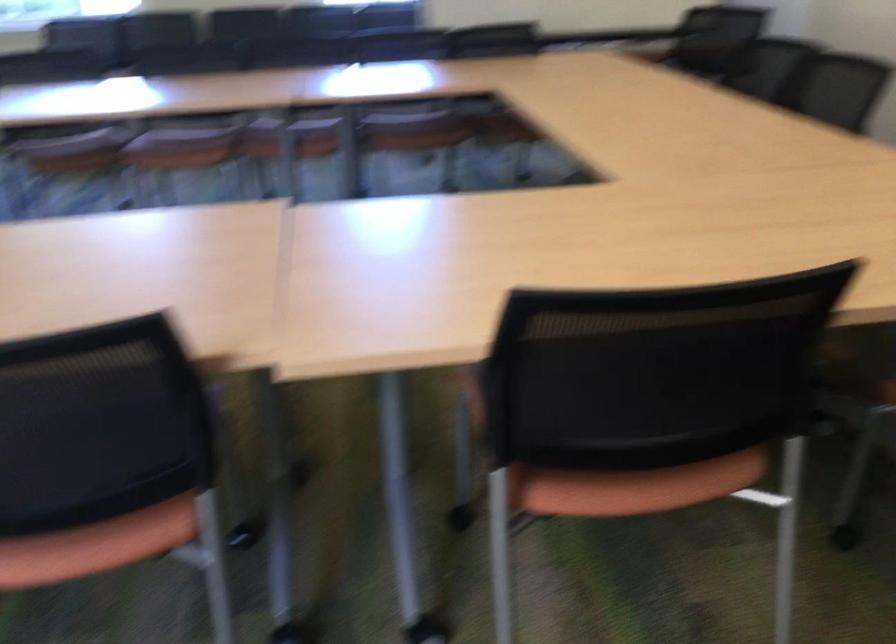
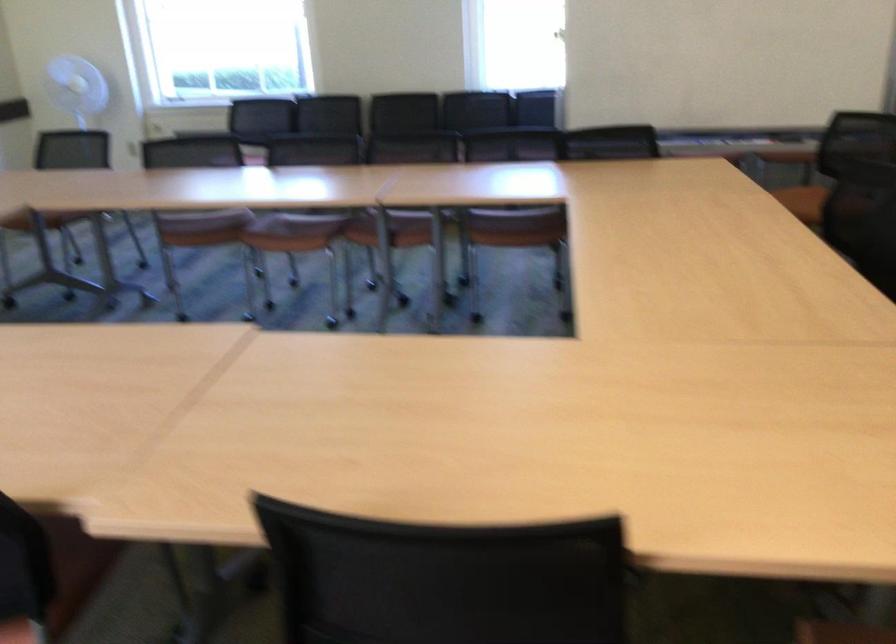
Locate, in the second image, the point that corresponds to point (271, 140) in the first image.

(391, 230)